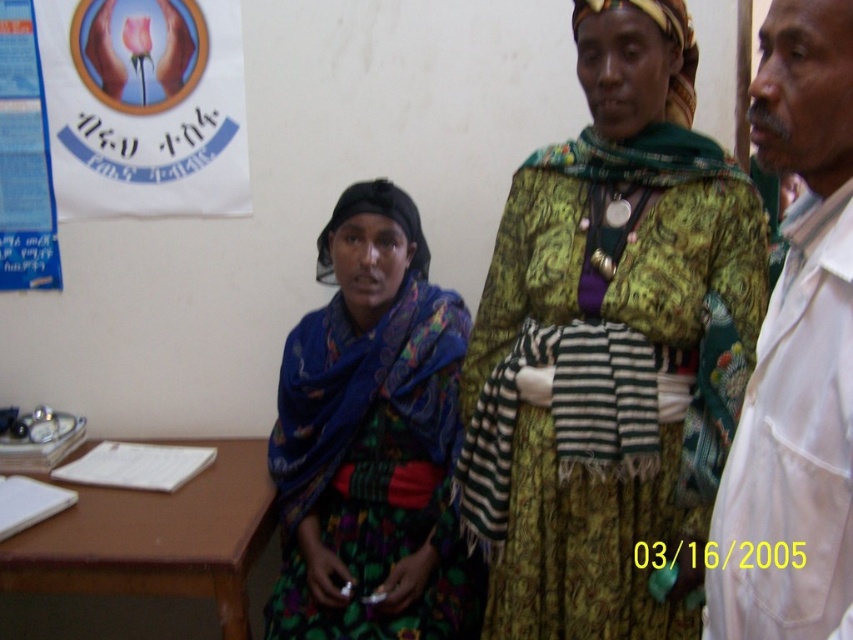
From the picture: You are a healthcare professional in this scene. You need to access the white smooth lab coat at right and the blue paper at left. Which one is taller?

The white smooth lab coat at right is taller than the blue paper at left.

You are standing in the room and want to take a photo of the point at coordinates (x=286, y=436). If your camera has a focal length of 50mm and the sensor size is 24mm wide, what is the width in feet of the field of view at that distance?

The width of the field of view at 6.19 feet distance can be calculated using the formula width in mm divided by focal length in mm multiplied by distance in feet. So, 24mm sensor width divided by 50mm focal length equals 0.48. Multiply that by 6.19 feet gives approximately 2.97 feet. Therefore, the field of view width is about 3 feet.

Which object is located at the coordinates point (796, 355)?

The white smooth lab coat at right is located at point (796, 355).